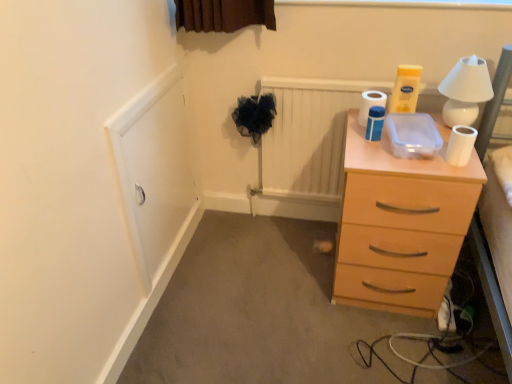
Identify the location of free space above light wood chest of drawers at right (from a real-world perspective). (417, 129).